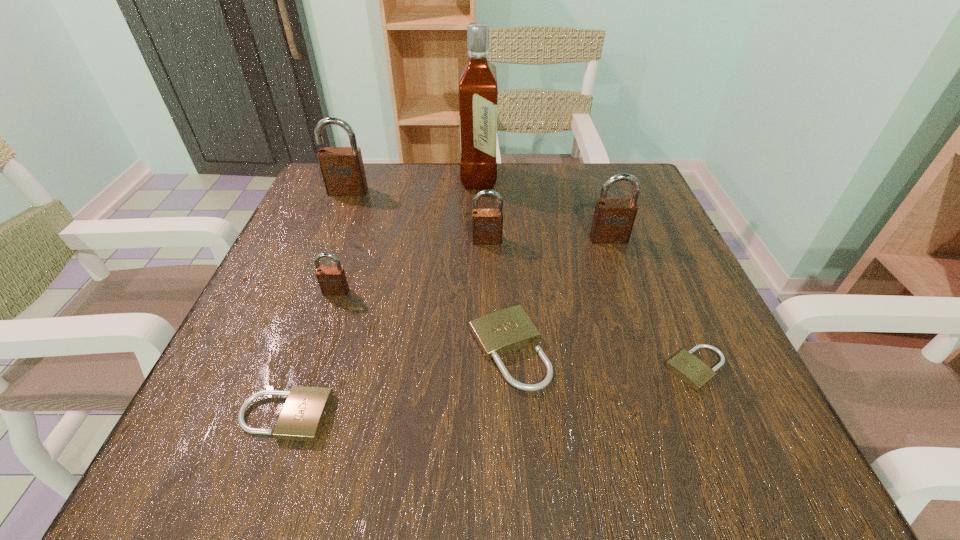
At what (x,y) coordinates should I click in order to perform the action: click on blank space located 0.190m on the back of the fifth tallest padlock. Please return your answer as a coordinate pair (x, y). Looking at the image, I should click on (503, 244).

Where is `free location located 0.050m on the right of the second shortest object`? The height and width of the screenshot is (540, 960). free location located 0.050m on the right of the second shortest object is located at coordinates (364, 416).

Where is `free space located 0.080m on the back of the shortest padlock`? The width and height of the screenshot is (960, 540). free space located 0.080m on the back of the shortest padlock is located at coordinates (671, 309).

The image size is (960, 540). What are the coordinates of `liquor at the far edge` in the screenshot? It's located at (478, 91).

The image size is (960, 540). Find the location of `padlock that is positioned at the far edge`. padlock that is positioned at the far edge is located at coordinates (342, 168).

Image resolution: width=960 pixels, height=540 pixels. In order to click on object present at the near edge in this screenshot , I will do `click(302, 417)`.

At what (x,y) coordinates should I click in order to perform the action: click on object located in the far left corner section of the desktop. Please return your answer as a coordinate pair (x, y). This screenshot has height=540, width=960. Looking at the image, I should click on (342, 168).

At what (x,y) coordinates should I click in order to perform the action: click on object positioned at the near left corner. Please return your answer as a coordinate pair (x, y). Looking at the image, I should click on (302, 417).

The height and width of the screenshot is (540, 960). In order to click on blank space at the far edge of the desktop in this screenshot , I will do `click(425, 184)`.

Where is `free region at the near edge`? This screenshot has height=540, width=960. free region at the near edge is located at coordinates (491, 440).